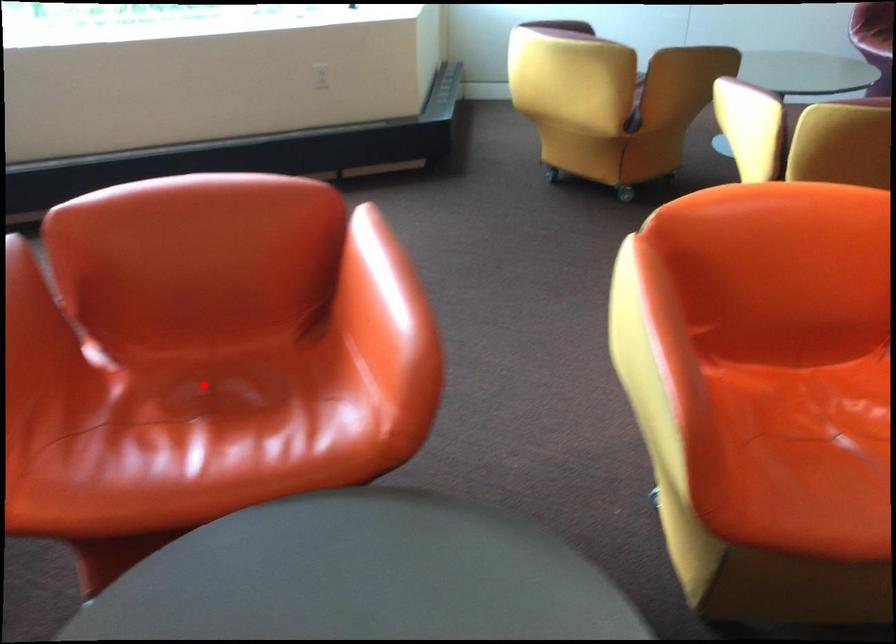
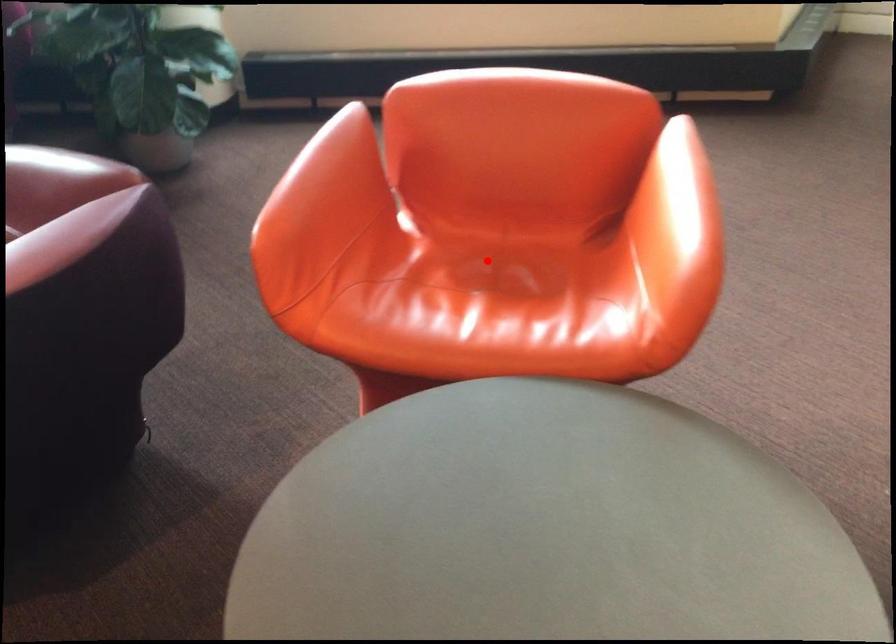
I am providing you with two images of the same scene from different viewpoints. A red point is marked on the first image and another point is marked on the second image. Is the red point in image1 aligned with the point shown in image2?

Yes